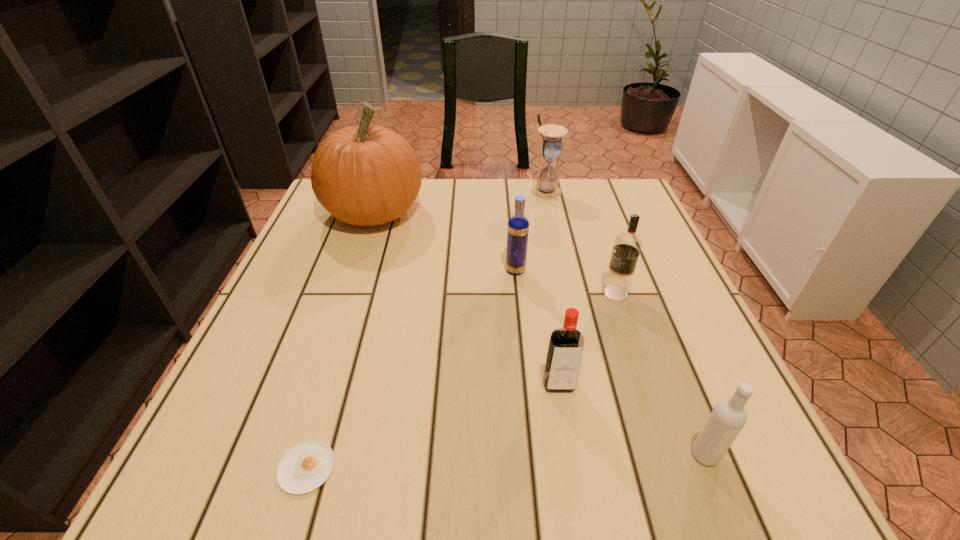
Where is `egg yolk`? The height and width of the screenshot is (540, 960). egg yolk is located at coordinates (306, 466).

At what (x,y) coordinates should I click in order to perform the action: click on vacant region located on the stem of the tallest object. Please return your answer as a coordinate pair (x, y). Looking at the image, I should click on (482, 213).

The width and height of the screenshot is (960, 540). What are the coordinates of `free space located 0.230m on the front of the hourglass` in the screenshot? It's located at (559, 250).

Where is `free space located on the label of the second vodka from right to left`? free space located on the label of the second vodka from right to left is located at coordinates (498, 292).

Locate an element on the screen. This screenshot has width=960, height=540. free spot located 0.380m on the label of the second vodka from right to left is located at coordinates (423, 292).

Locate an element on the screen. This screenshot has height=540, width=960. vacant space located 0.090m on the label of the second vodka from right to left is located at coordinates (559, 292).

What are the coordinates of `free space located on the front of the fifth nearest object` in the screenshot? It's located at (524, 368).

This screenshot has height=540, width=960. Find the location of `free space located 0.060m on the front and back of the second nearest vodka`. free space located 0.060m on the front and back of the second nearest vodka is located at coordinates (565, 426).

You are a GUI agent. You are given a task and a screenshot of the screen. Output one action in this format:
    pyautogui.click(x=<x>, y=<y>)
    Task: Click on the free space located 0.380m on the back of the rightmost vodka
    
    Given the screenshot: What is the action you would take?
    pyautogui.click(x=635, y=281)

Where is `vacant space located on the right of the shortest object`? The height and width of the screenshot is (540, 960). vacant space located on the right of the shortest object is located at coordinates (374, 468).